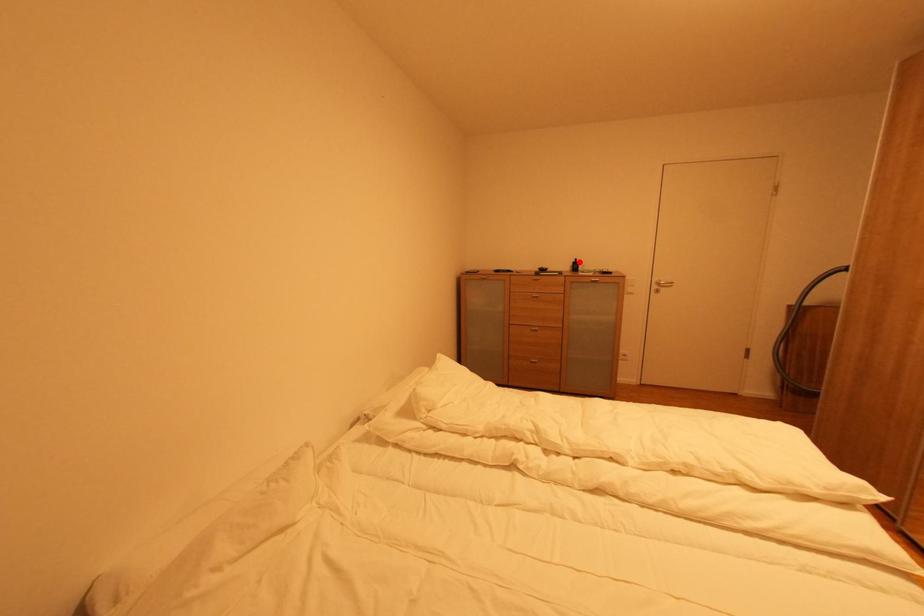
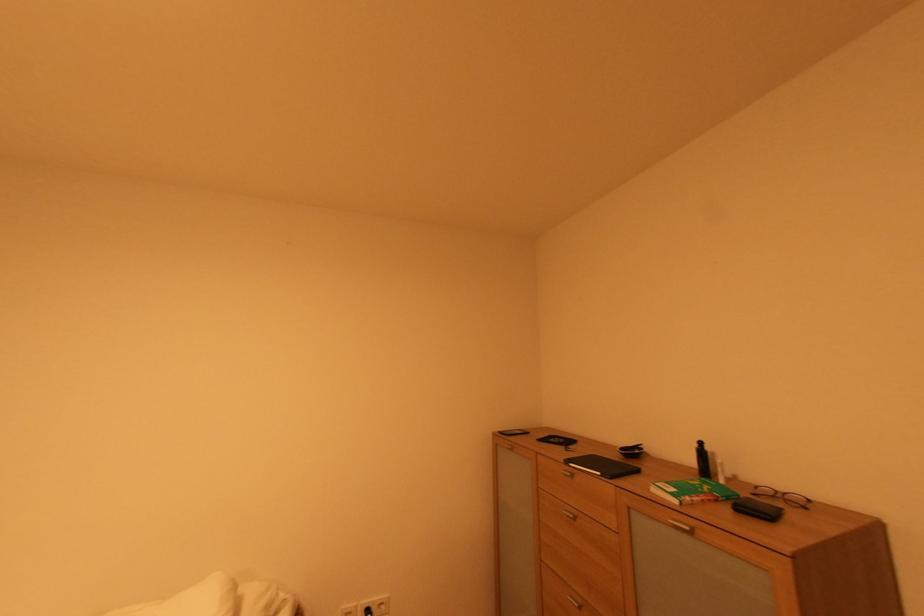
Locate, in the second image, the point that corresponds to the highlighted location in the first image.

(701, 447)